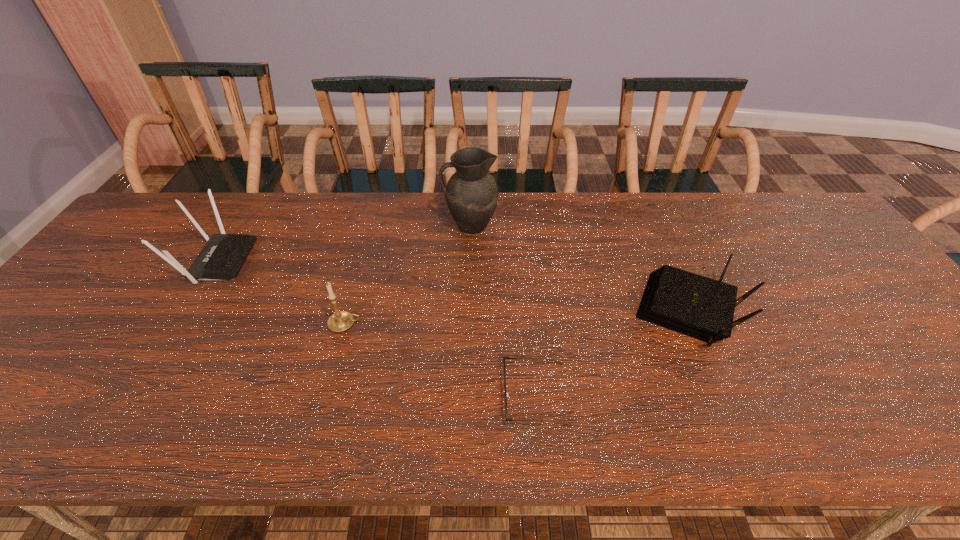
This screenshot has height=540, width=960. I want to click on vacant region located 0.250m on the side of the tallest object with the handle, so [x=361, y=226].

The height and width of the screenshot is (540, 960). Identify the location of free space located 0.160m on the front-facing side of the left router. (305, 261).

Locate an element on the screen. This screenshot has height=540, width=960. free space located 0.190m on the handle side of the candle holder is located at coordinates (440, 325).

Locate an element on the screen. The image size is (960, 540). vacant point located on the back of the right router is located at coordinates (655, 233).

The width and height of the screenshot is (960, 540). In order to click on vacant space located 0.370m on the front-facing side of the nearest object in this screenshot , I will do `click(331, 394)`.

The width and height of the screenshot is (960, 540). Identify the location of blank space located on the front-facing side of the nearest object. (323, 394).

The height and width of the screenshot is (540, 960). I want to click on vacant space positioned 0.160m on the front-facing side of the nearest object, so click(x=429, y=394).

At what (x,y) coordinates should I click in order to perform the action: click on pitcher that is at the far edge. Please return your answer as a coordinate pair (x, y). Looking at the image, I should click on (471, 193).

Locate an element on the screen. The width and height of the screenshot is (960, 540). router located at the far edge is located at coordinates (221, 258).

This screenshot has width=960, height=540. What are the coordinates of `object that is positioned at the near edge` in the screenshot? It's located at (504, 357).